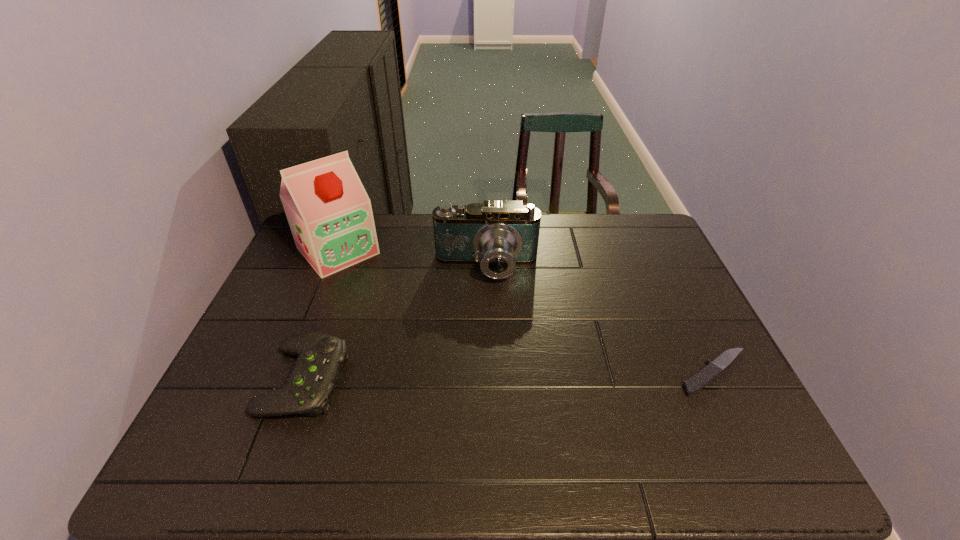
You are a GUI agent. You are given a task and a screenshot of the screen. Output one action in this format:
    pyautogui.click(x=<x>, y=<y>)
    Task: Click on the vacant region between the second object from right to left and the rightmost object
    The height and width of the screenshot is (540, 960).
    Given the screenshot: What is the action you would take?
    click(x=601, y=320)

You are a GUI agent. You are given a task and a screenshot of the screen. Output one action in this format:
    pyautogui.click(x=<x>, y=<y>)
    Task: Click on the vacant region between the third shortest object and the tallest object
    Image resolution: width=960 pixels, height=540 pixels.
    Given the screenshot: What is the action you would take?
    pyautogui.click(x=412, y=259)

Identify the location of vacant space in between the camcorder and the tallest object. click(412, 259).

This screenshot has height=540, width=960. What are the coordinates of `free space between the steak knife and the camcorder` in the screenshot? It's located at (601, 320).

What are the coordinates of `empty location between the shortest object and the second object from right to left` in the screenshot? It's located at (601, 320).

Locate an element on the screen. free space between the tallest object and the rightmost object is located at coordinates (527, 312).

This screenshot has height=540, width=960. I want to click on object that is the second closest one to the second object from right to left, so click(x=316, y=371).

Choose which object is the second nearest neighbor to the second tallest object. Please provide its 2D coordinates. Your answer should be formatted as a tuple, i.e. [(x, y)], where the tuple contains the x and y coordinates of a point satisfying the conditions above.

[(316, 371)]

The height and width of the screenshot is (540, 960). I want to click on vacant position in the image that satisfies the following two spatial constraints: 1. on the front side of the second tallest object; 2. on the right side of the shortest object, so click(488, 373).

Image resolution: width=960 pixels, height=540 pixels. In order to click on free space that satisfies the following two spatial constraints: 1. on the front side of the rightmost object; 2. on the right side of the second tallest object in this screenshot , I will do [488, 373].